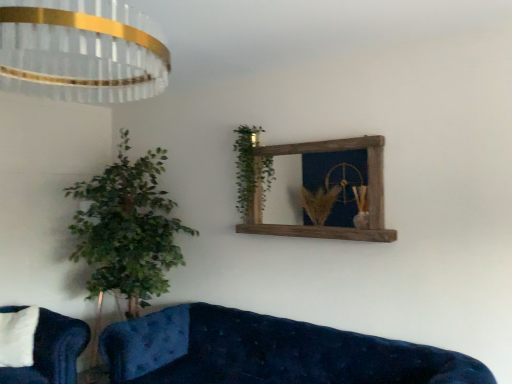
Question: Can velvet blue studio couch at lower left, the 1th studio couch positioned from the left, be found inside green leafy plant at upper center?

Choices:
 (A) yes
 (B) no

Answer: (B)

Question: Is green leafy plant at upper center located outside velvet blue studio couch at lower left, the 2th studio couch in the right-to-left sequence?

Choices:
 (A) no
 (B) yes

Answer: (B)

Question: Is green leafy plant at upper center aimed at velvet blue studio couch at lower left, the 2th studio couch in the right-to-left sequence?

Choices:
 (A) no
 (B) yes

Answer: (A)

Question: Can you confirm if green leafy plant at upper center is bigger than velvet blue studio couch at lower left, the 1th studio couch positioned from the left?

Choices:
 (A) yes
 (B) no

Answer: (B)

Question: Can you confirm if green leafy plant at upper center is taller than velvet blue studio couch at lower left, the 2th studio couch positioned from the front?

Choices:
 (A) no
 (B) yes

Answer: (B)

Question: In the image, is green leafy plant at upper center on the left side or the right side of crystal glass chandelier at upper left?

Choices:
 (A) right
 (B) left

Answer: (A)

Question: Considering the positions of green leafy plant at upper center and crystal glass chandelier at upper left in the image, is green leafy plant at upper center bigger or smaller than crystal glass chandelier at upper left?

Choices:
 (A) small
 (B) big

Answer: (A)

Question: Does point (266, 180) appear closer or farther from the camera than point (96, 16)?

Choices:
 (A) farther
 (B) closer

Answer: (A)

Question: From a real-world perspective, is green leafy plant at upper center physically located above or below crystal glass chandelier at upper left?

Choices:
 (A) above
 (B) below

Answer: (B)

Question: From the image's perspective, relative to crystal glass chandelier at upper left, is velvet blue studio couch at lower left, the 1th studio couch positioned from the left, above or below?

Choices:
 (A) above
 (B) below

Answer: (B)

Question: From a real-world perspective, is velvet blue studio couch at lower left, the 2th studio couch positioned from the front, physically located above or below crystal glass chandelier at upper left?

Choices:
 (A) below
 (B) above

Answer: (A)

Question: Is point (74, 324) positioned closer to the camera than point (153, 48)?

Choices:
 (A) farther
 (B) closer

Answer: (A)

Question: Choose the correct answer: Is velvet blue studio couch at lower left, which is the first studio couch from back to front, inside crystal glass chandelier at upper left or outside it?

Choices:
 (A) inside
 (B) outside

Answer: (B)

Question: Visually, is rustic wood mirror at upper center positioned to the left or to the right of green leafy plant at left?

Choices:
 (A) left
 (B) right

Answer: (B)

Question: In terms of width, does rustic wood mirror at upper center look wider or thinner when compared to green leafy plant at left?

Choices:
 (A) wide
 (B) thin

Answer: (B)